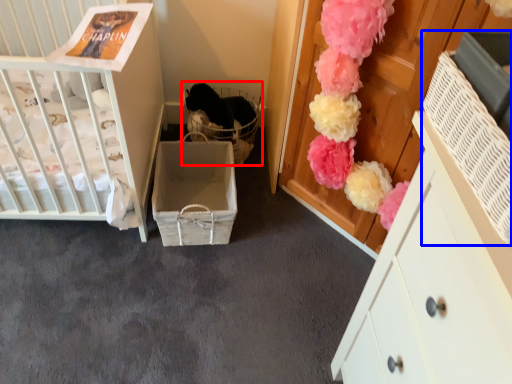
Question: Which of the following is the closest to the observer, baby carriage (highlighted by a red box) or storage box (highlighted by a blue box)?

Choices:
 (A) baby carriage
 (B) storage box

Answer: (B)